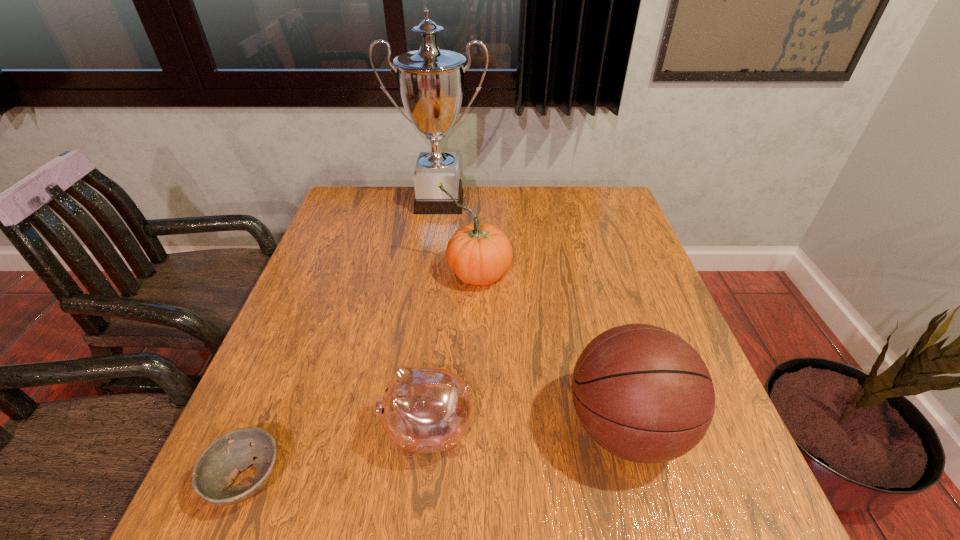
Image resolution: width=960 pixels, height=540 pixels. In order to click on object at the near right corner in this screenshot , I will do `click(644, 394)`.

Locate an element on the screen. vacant space at the far edge of the desktop is located at coordinates (395, 197).

Where is `vacant space at the left edge`? vacant space at the left edge is located at coordinates (345, 319).

Find the location of `vacant space at the right edge`. vacant space at the right edge is located at coordinates (660, 315).

You are a GUI agent. You are given a task and a screenshot of the screen. Output one action in this format:
    pyautogui.click(x=<x>, y=<y>)
    Task: Click on the free space at the far left corner
    The height and width of the screenshot is (540, 960).
    Given the screenshot: What is the action you would take?
    pyautogui.click(x=374, y=224)

In the image, there is a desktop. Where is `vacant space at the near left corner`? The image size is (960, 540). vacant space at the near left corner is located at coordinates (295, 512).

Find the location of `free space at the near right corner`. free space at the near right corner is located at coordinates (724, 488).

Where is `vacant area between the fourth nearest object and the bowl`? The image size is (960, 540). vacant area between the fourth nearest object and the bowl is located at coordinates [362, 376].

Find the location of `empty space between the shortest object and the second shortest object`. empty space between the shortest object and the second shortest object is located at coordinates (338, 455).

The height and width of the screenshot is (540, 960). Find the location of `blank region between the fourth nearest object and the piggy bank`. blank region between the fourth nearest object and the piggy bank is located at coordinates (452, 352).